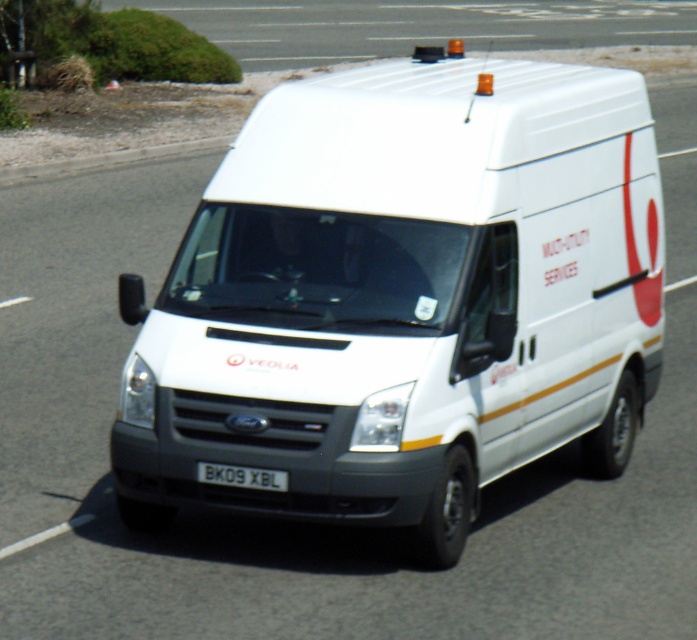
You are a traffic officer observing a white matte van at center and a black plastic license plate at center. Which object is closer to you?

The white matte van at center is closer to you because it is in front of the black plastic license plate at center.

You are a traffic officer observing a white matte van at center with a black plastic license plate at center. Which object would you estimate to be bigger in size?

The white matte van at center is larger in size than the black plastic license plate at center.

You are a traffic officer observing a white matte van at center and a black plastic license plate at center. Which object is positioned higher in the image?

The white matte van at center is located above the black plastic license plate at center, so it is positioned higher in the image.